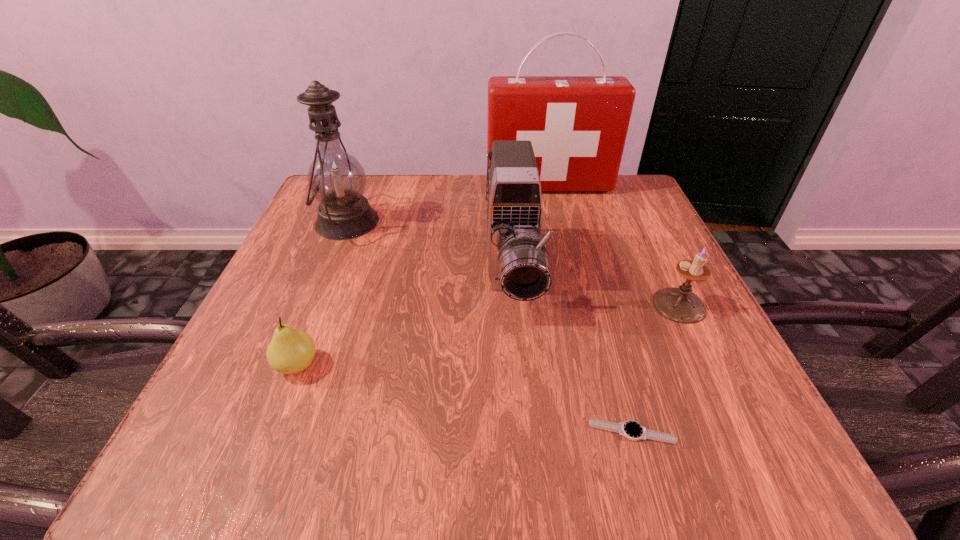
Locate an element on the screen. Image resolution: width=960 pixels, height=540 pixels. empty space between the oil lamp and the pear is located at coordinates (323, 294).

The image size is (960, 540). I want to click on vacant space that is in between the fifth farthest object and the oil lamp, so click(x=323, y=294).

I want to click on object that is the closest one to the oil lamp, so click(x=519, y=265).

Where is `object that is the closest to the watch`? The width and height of the screenshot is (960, 540). object that is the closest to the watch is located at coordinates (519, 265).

Locate an element on the screen. vacant space that satisfies the following two spatial constraints: 1. at the front of the watch, highlighting the lens; 2. on the right side of the camcorder is located at coordinates (525, 432).

In order to click on free location that satisfies the following two spatial constraints: 1. at the front of the third shortest object, highlighting the lens; 2. on the left side of the camcorder in this screenshot , I will do `click(515, 305)`.

Image resolution: width=960 pixels, height=540 pixels. I want to click on vacant space that satisfies the following two spatial constraints: 1. at the front of the fourth shortest object, highlighting the lens; 2. on the right side of the candle holder, so click(x=515, y=305).

Where is `free space that satisfies the following two spatial constraints: 1. on the front face of the third shortest object; 2. on the left side of the farthest object`? free space that satisfies the following two spatial constraints: 1. on the front face of the third shortest object; 2. on the left side of the farthest object is located at coordinates pyautogui.click(x=577, y=305).